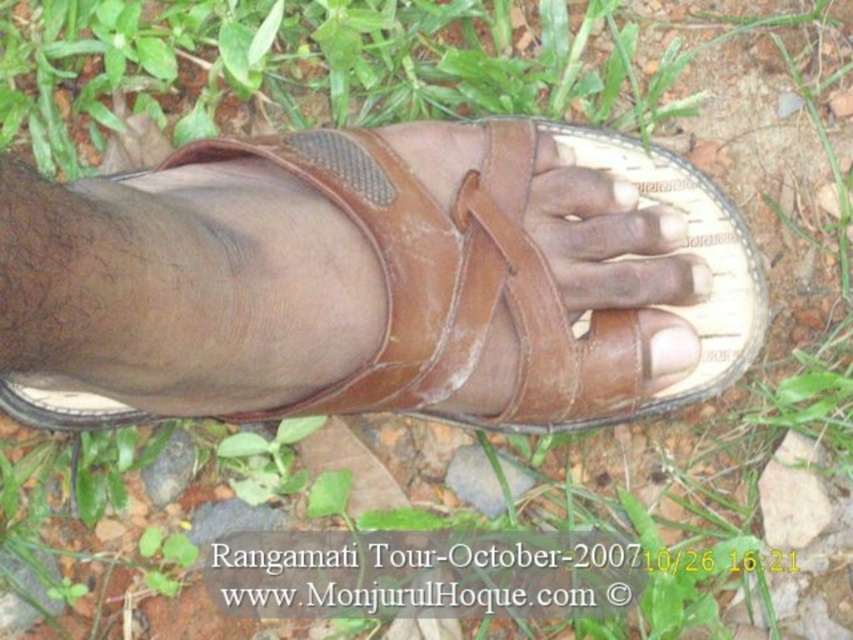
Which is more to the left, brown leather sandal at center or matte brown toe at center?

From the viewer's perspective, brown leather sandal at center appears more on the left side.

What do you see at coordinates (682, 250) in the screenshot?
I see `brown leather sandal at center` at bounding box center [682, 250].

This screenshot has height=640, width=853. Describe the element at coordinates (682, 250) in the screenshot. I see `brown leather sandal at center` at that location.

You are a GUI agent. You are given a task and a screenshot of the screen. Output one action in this format:
    pyautogui.click(x=<x>, y=<y>)
    Task: Click on the brown leather sandal at center
    
    Given the screenshot: What is the action you would take?
    pyautogui.click(x=682, y=250)